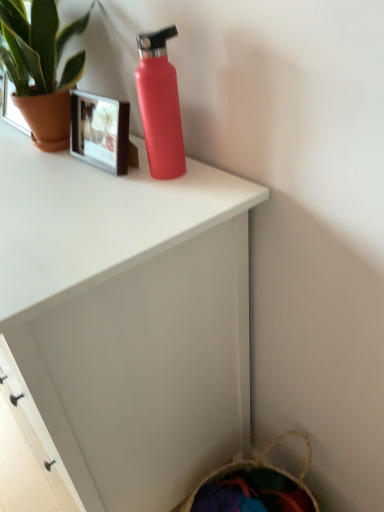
Question: Considering the positions of point (59, 112) and point (97, 259), is point (59, 112) closer or farther from the camera than point (97, 259)?

Choices:
 (A) closer
 (B) farther

Answer: (B)

Question: Looking at the image, does green matte plant at upper left seem bigger or smaller compared to matte red water bottle at upper center?

Choices:
 (A) small
 (B) big

Answer: (A)

Question: Which is farther from the green matte plant at upper left?

Choices:
 (A) matte red water bottle at upper center
 (B) matte pink bottle at upper center

Answer: (A)

Question: Which of these objects is positioned closest to the green matte plant at upper left?

Choices:
 (A) matte pink bottle at upper center
 (B) matte red water bottle at upper center

Answer: (A)